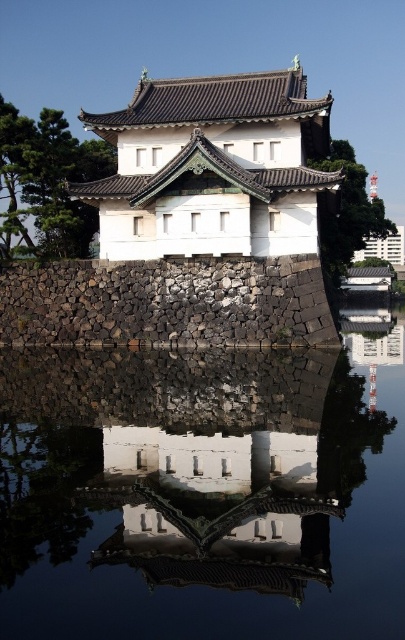
Question: Does white stone building at center have a smaller size compared to black stone wall at center?

Choices:
 (A) yes
 (B) no

Answer: (B)

Question: Considering the real-world distances, which object is farthest from the black stone wall at center?

Choices:
 (A) white stone building at center
 (B) transparent glass water at center

Answer: (B)

Question: Can you confirm if transparent glass water at center is positioned to the right of black stone wall at center?

Choices:
 (A) no
 (B) yes

Answer: (B)

Question: Which point is closer to the camera?

Choices:
 (A) white stone building at center
 (B) black stone wall at center
 (C) transparent glass water at center

Answer: (C)

Question: Is transparent glass water at center wider than black stone wall at center?

Choices:
 (A) yes
 (B) no

Answer: (A)

Question: Which object is the farthest from the white stone building at center?

Choices:
 (A) black stone wall at center
 (B) transparent glass water at center

Answer: (B)